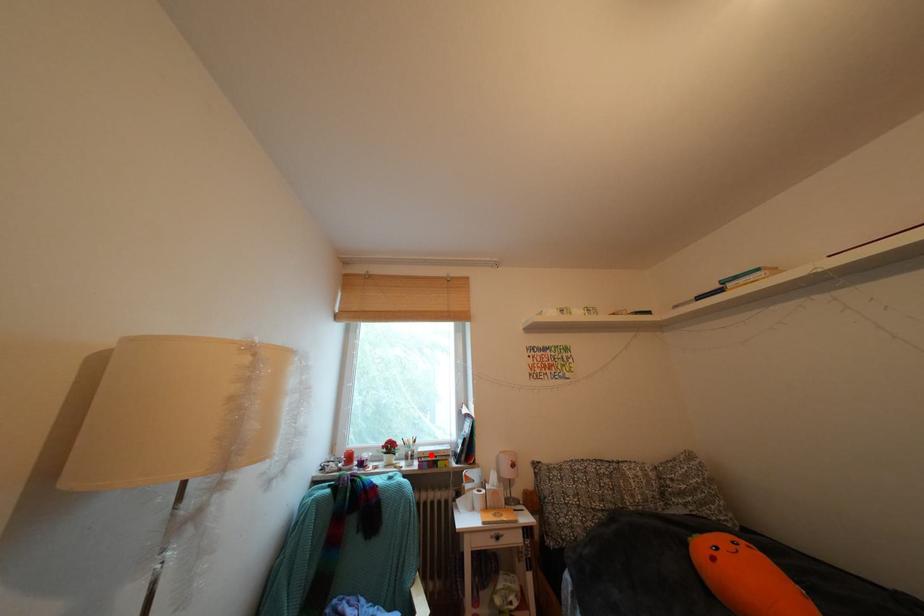
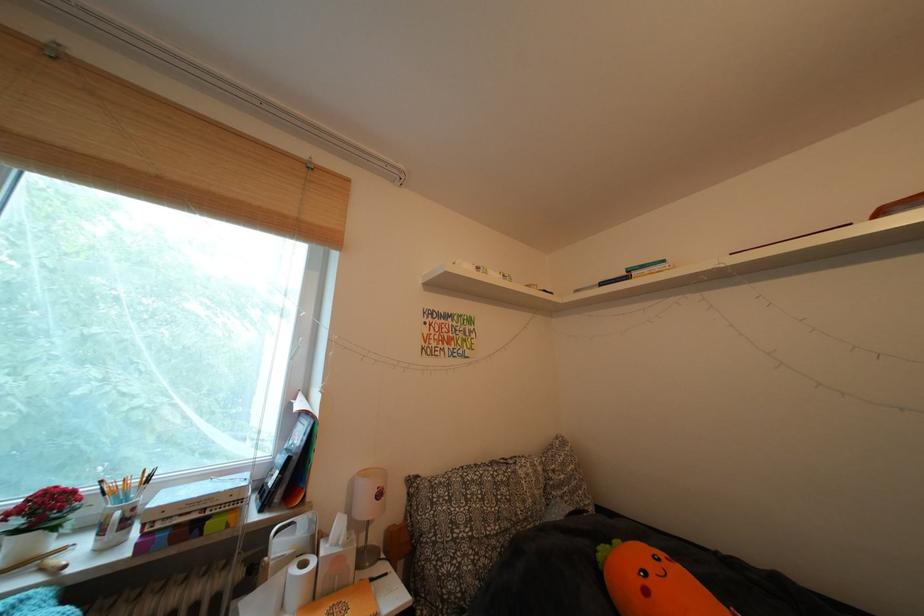
Question: I am providing you with two images of the same scene from different viewpoints. In image1, a red point is highlighted. Considering the same 3D point in image2, which of the following is correct?

Choices:
 (A) It is closer
 (B) It is farther

Answer: (A)